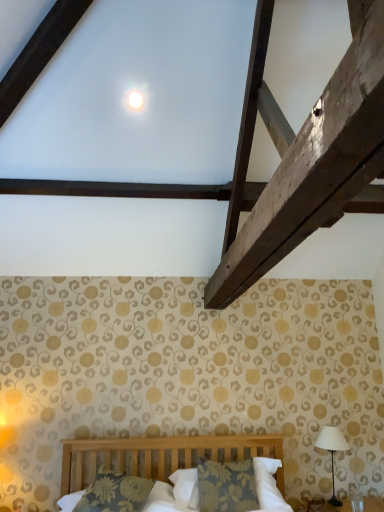
Question: Considering the relative sizes of floral fabric pillow at center, marked as the first pillow in a right-to-left arrangement, and white fabric-covered lampshade at right in the image provided, is floral fabric pillow at center, marked as the first pillow in a right-to-left arrangement, smaller than white fabric-covered lampshade at right?

Choices:
 (A) yes
 (B) no

Answer: (B)

Question: Can you see floral fabric pillow at center, marked as the first pillow in a right-to-left arrangement, touching white fabric-covered lampshade at right?

Choices:
 (A) no
 (B) yes

Answer: (A)

Question: From a real-world perspective, is floral fabric pillow at center, the 2th pillow from the left, under white fabric-covered lampshade at right?

Choices:
 (A) no
 (B) yes

Answer: (B)

Question: From a real-world perspective, is floral fabric pillow at center, marked as the first pillow in a right-to-left arrangement, on white fabric-covered lampshade at right?

Choices:
 (A) no
 (B) yes

Answer: (A)

Question: Could you tell me if floral fabric pillow at center, marked as the first pillow in a right-to-left arrangement, is facing white fabric-covered lampshade at right?

Choices:
 (A) no
 (B) yes

Answer: (A)

Question: Is floral fabric pillow at center, marked as the first pillow in a right-to-left arrangement, thinner than white fabric-covered lampshade at right?

Choices:
 (A) yes
 (B) no

Answer: (B)

Question: Does white glossy moonlight at upper center have a greater height compared to white fabric-covered lampshade at right?

Choices:
 (A) yes
 (B) no

Answer: (B)

Question: Is the position of white glossy moonlight at upper center less distant than that of white fabric-covered lampshade at right?

Choices:
 (A) no
 (B) yes

Answer: (B)

Question: Is white fabric-covered lampshade at right completely or partially inside white glossy moonlight at upper center?

Choices:
 (A) no
 (B) yes

Answer: (A)

Question: From a real-world perspective, does white glossy moonlight at upper center stand above white fabric-covered lampshade at right?

Choices:
 (A) yes
 (B) no

Answer: (A)

Question: Is white glossy moonlight at upper center facing towards white fabric-covered lampshade at right?

Choices:
 (A) yes
 (B) no

Answer: (B)

Question: Is white glossy moonlight at upper center smaller than white fabric-covered lampshade at right?

Choices:
 (A) no
 (B) yes

Answer: (B)

Question: Is white glossy moonlight at upper center thinner than floral-patterned fabric pillow at center, the 1th pillow from the left?

Choices:
 (A) yes
 (B) no

Answer: (A)